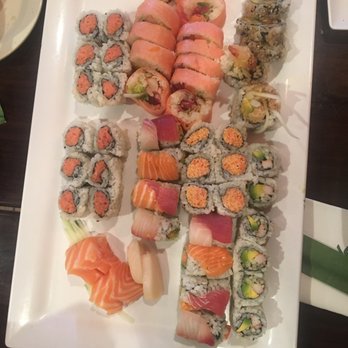
Identify the location of circular plate. This screenshot has width=348, height=348. (22, 21).